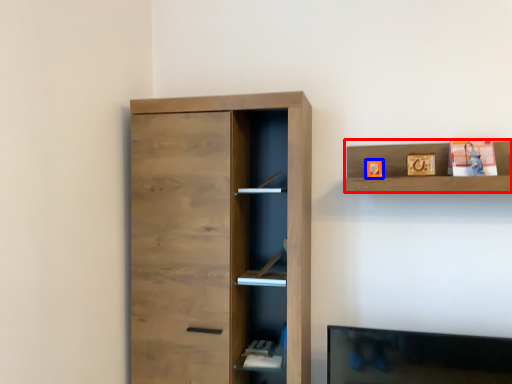
Question: Among these objects, which one is nearest to the camera, shelf (highlighted by a red box) or toy (highlighted by a blue box)?

Choices:
 (A) shelf
 (B) toy

Answer: (A)